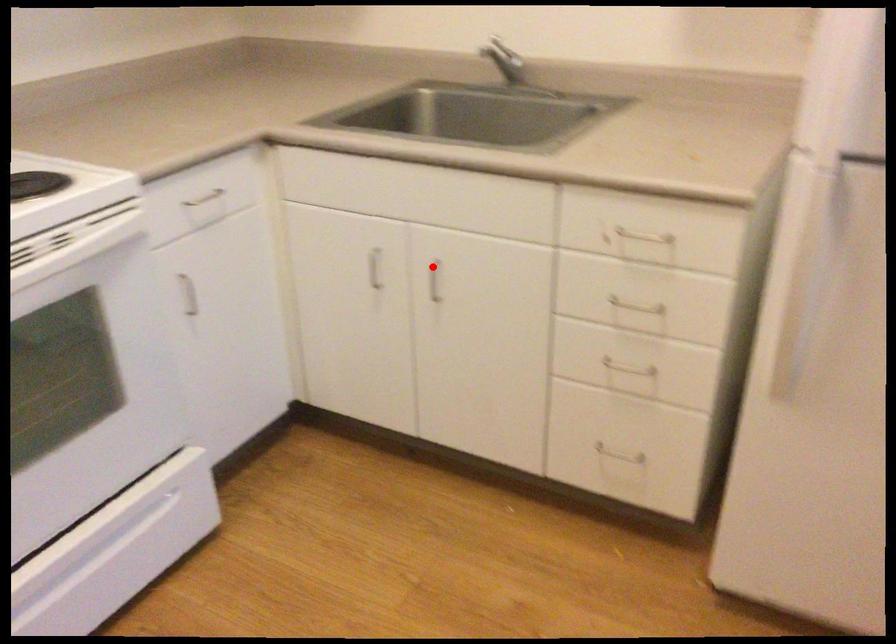
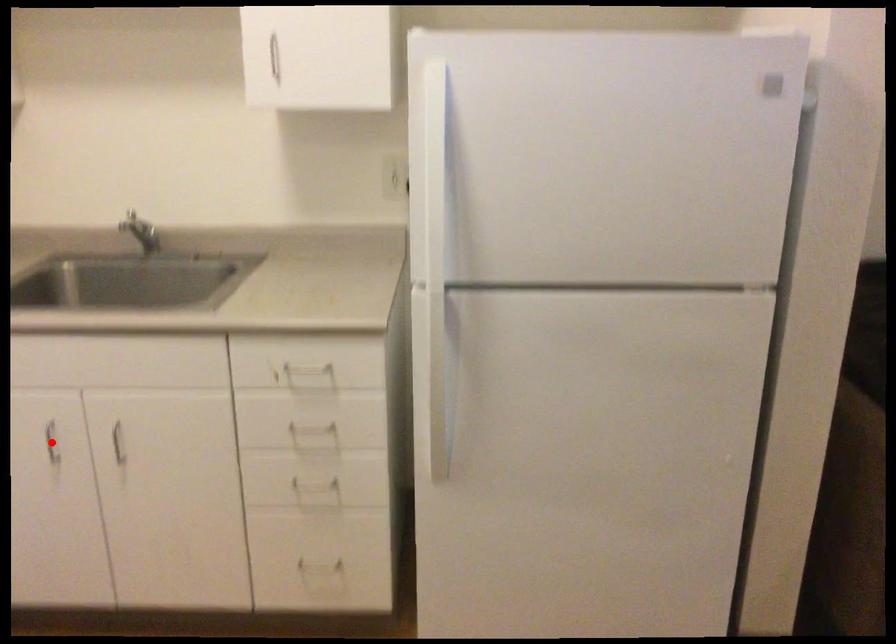
I am providing you with two images of the same scene from different viewpoints. A red point is marked on the first image and another point is marked on the second image. Does the point marked in image1 correspond to the same location as the one in image2?

No